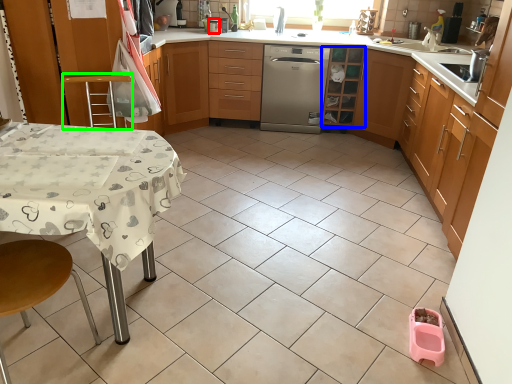
Question: Based on their relative distances, which object is farther from appliance (highlighted by a red box)? Choose from cabinetry (highlighted by a blue box) and step stool (highlighted by a green box).

Choices:
 (A) cabinetry
 (B) step stool

Answer: (B)